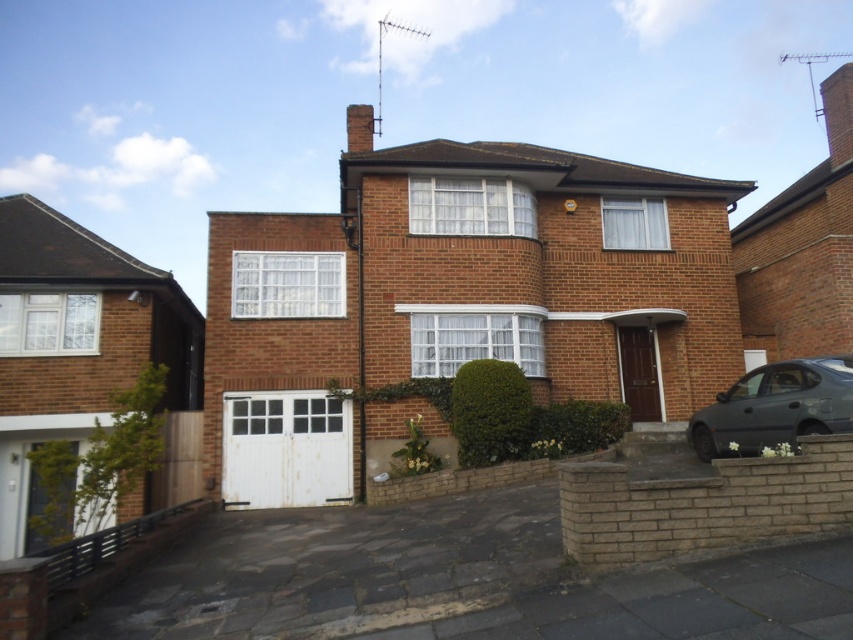
Question: Which point is closer to the camera?

Choices:
 (A) (775, 435)
 (B) (247, 477)

Answer: (A)

Question: Does white painted wood garage door at lower center have a larger size compared to dark gray metallic car at lower right?

Choices:
 (A) yes
 (B) no

Answer: (B)

Question: Is the position of white painted wood garage door at lower center less distant than that of dark gray metallic car at lower right?

Choices:
 (A) yes
 (B) no

Answer: (B)

Question: Which object is closer to the camera taking this photo?

Choices:
 (A) dark gray metallic car at lower right
 (B) white painted wood garage door at lower center

Answer: (A)

Question: Which point is closer to the camera?

Choices:
 (A) white painted wood garage door at lower center
 (B) dark gray metallic car at lower right

Answer: (B)

Question: In this image, where is white painted wood garage door at lower center located relative to dark gray metallic car at lower right?

Choices:
 (A) below
 (B) above

Answer: (A)